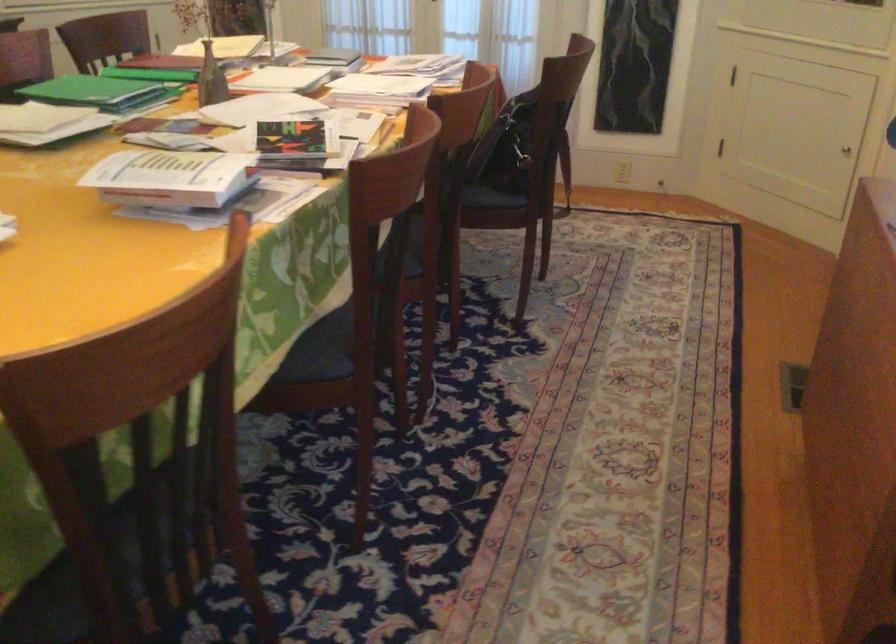
Where would you lift the green binder? Please return your answer as a coordinate pair (x, y).

(99, 91)